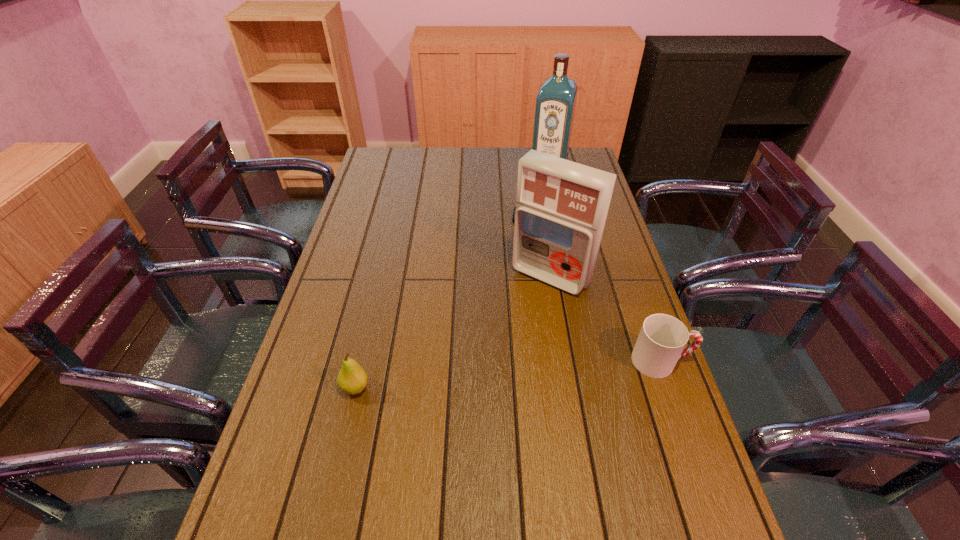
Image resolution: width=960 pixels, height=540 pixels. In order to click on liquor present at the right edge in this screenshot , I will do click(555, 104).

I want to click on the first-aid kit that is at the right edge, so click(x=561, y=206).

Locate an element on the screen. This screenshot has width=960, height=540. object that is at the far right corner is located at coordinates (555, 104).

The height and width of the screenshot is (540, 960). I want to click on free region at the far edge, so click(459, 165).

Where is `free space at the left edge`? The image size is (960, 540). free space at the left edge is located at coordinates (321, 344).

Where is `vacant space at the right edge of the desktop`? The image size is (960, 540). vacant space at the right edge of the desktop is located at coordinates (611, 282).

In order to click on free spot between the first-aid kit and the cup in this screenshot , I will do `click(606, 319)`.

Where is `vacant area between the cup and the liquor`? vacant area between the cup and the liquor is located at coordinates (605, 265).

You are a GUI agent. You are given a task and a screenshot of the screen. Output one action in this format:
    pyautogui.click(x=<x>, y=<y>)
    Task: Click on the empty space that is in between the rightmost object and the farthest object
    The width and height of the screenshot is (960, 540).
    Given the screenshot: What is the action you would take?
    pyautogui.click(x=605, y=265)

Image resolution: width=960 pixels, height=540 pixels. What are the coordinates of `free space between the shortest object and the leftmost object` in the screenshot? It's located at (443, 303).